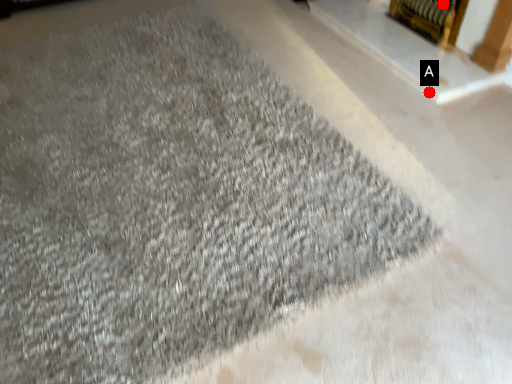
Question: Two points are circled on the image, labeled by A and B beside each circle. Which point appears closest to the camera in this image?

Choices:
 (A) A is closer
 (B) B is closer

Answer: (A)